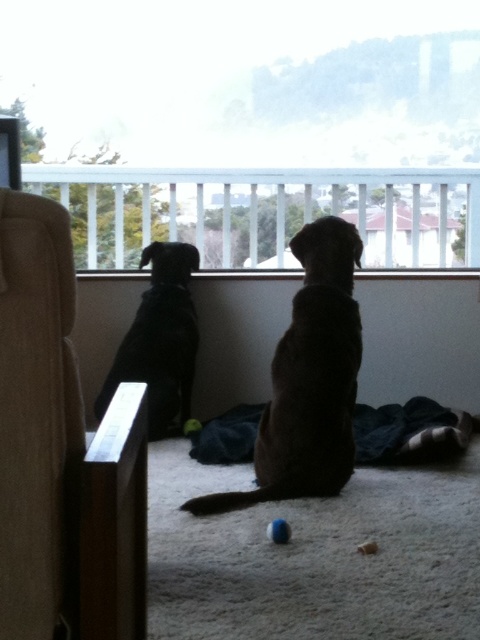
You are standing at the entrance of the room and want to move towards the window. There are two points marked in the scene, point (192,502) and point (188,429). Which point should you step on first to reach the window?

You should step on point (192,502) first because it is in front of point (188,429), meaning it is closer to the window.

You are a toy designer who wants to create a toy that fits under the brown furry dog at center without being seen by someone passing by. Considering the size of the rubber ball at center, which is smaller than the dog, where should you place the toy?

The brown furry dog at center is taller than the rubber ball at center, so placing the toy under the brown furry dog at center would hide it from view since the dog is taller than the ball.